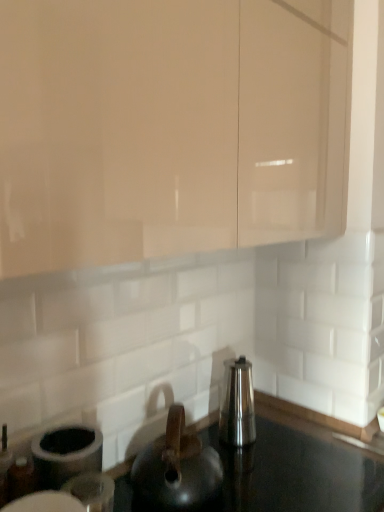
Identify the location of black glossy countertop at center. Image resolution: width=384 pixels, height=512 pixels. (296, 469).

What do you see at coordinates (296, 469) in the screenshot? I see `black glossy countertop at center` at bounding box center [296, 469].

This screenshot has width=384, height=512. I want to click on matte beige cabinet at upper center, so click(x=170, y=127).

Image resolution: width=384 pixels, height=512 pixels. What do you see at coordinates (237, 404) in the screenshot?
I see `satin silver kettle at center` at bounding box center [237, 404].

Find the location of a particular element. black glossy countertop at center is located at coordinates (296, 469).

Is matte beige cabinet at upper center facing towards satin silver kettle at center?

No, matte beige cabinet at upper center is not facing towards satin silver kettle at center.

Is matte beige cabinet at upper center taller or shorter than satin silver kettle at center?

Considering their sizes, matte beige cabinet at upper center has more height than satin silver kettle at center.

Is matte beige cabinet at upper center to the left or to the right of satin silver kettle at center in the image?

matte beige cabinet at upper center is positioned on satin silver kettle at center's left side.

Are matte black kettle at center and satin silver kettle at center making contact?

Yes, matte black kettle at center is right next to satin silver kettle at center and making contact.

Considering the sizes of objects matte black kettle at center and satin silver kettle at center in the image provided, who is shorter, matte black kettle at center or satin silver kettle at center?

Standing shorter between the two is matte black kettle at center.

Is matte black kettle at center at the right side of satin silver kettle at center?

In fact, matte black kettle at center is to the left of satin silver kettle at center.

Does matte black kettle at center have a larger size compared to satin silver kettle at center?

Yes, matte black kettle at center is bigger than satin silver kettle at center.

Identify the location of appliance located on the left of black glossy countertop at center. The height and width of the screenshot is (512, 384). (237, 404).

From a real-world perspective, is satin silver kettle at center positioned above or below black glossy countertop at center?

satin silver kettle at center is above black glossy countertop at center.

Is satin silver kettle at center wider or thinner than black glossy countertop at center?

In the image, satin silver kettle at center appears to be more narrow than black glossy countertop at center.

Is satin silver kettle at center not within black glossy countertop at center?

Indeed, satin silver kettle at center is completely outside black glossy countertop at center.

Is matte black kettle at center taller than matte beige cabinet at upper center?

Incorrect, the height of matte black kettle at center is not larger of that of matte beige cabinet at upper center.

Does matte black kettle at center come behind matte beige cabinet at upper center?

Yes.

From a real-world perspective, is black glossy countertop at center below matte beige cabinet at upper center?

Correct, in the physical world, black glossy countertop at center is lower than matte beige cabinet at upper center.

Which of these two, black glossy countertop at center or matte beige cabinet at upper center, is bigger?

matte beige cabinet at upper center.

Which object is positioned more to the right, black glossy countertop at center or matte beige cabinet at upper center?

From the viewer's perspective, black glossy countertop at center appears more on the right side.

Does satin silver kettle at center come in front of matte beige cabinet at upper center?

No, satin silver kettle at center is behind matte beige cabinet at upper center.

Looking at this image, from a real-world perspective, is satin silver kettle at center above or below matte beige cabinet at upper center?

satin silver kettle at center is below matte beige cabinet at upper center.

The height and width of the screenshot is (512, 384). Identify the location of cabinetry that appears above the satin silver kettle at center (from the image's perspective). (170, 127).

Are satin silver kettle at center and matte beige cabinet at upper center far apart?

satin silver kettle at center is near matte beige cabinet at upper center, not far away.

Between matte beige cabinet at upper center and matte black kettle at center, which one appears on the right side from the viewer's perspective?

Positioned to the right is matte beige cabinet at upper center.

Is matte beige cabinet at upper center positioned with its back to matte black kettle at center?

No, matte beige cabinet at upper center is not facing the opposite direction of matte black kettle at center.

Looking at this image, is matte beige cabinet at upper center thinner than matte black kettle at center?

No, matte beige cabinet at upper center is not thinner than matte black kettle at center.

Image resolution: width=384 pixels, height=512 pixels. What are the coordinates of `sink located on the left of matte beige cabinet at upper center` in the screenshot? It's located at (177, 470).

Locate an element on the screen. cabinetry on the left of satin silver kettle at center is located at coordinates (170, 127).

In order to click on appliance that is above the matte black kettle at center (from the image's perspective) in this screenshot , I will do `click(237, 404)`.

Looking at the image, which one is located closer to matte beige cabinet at upper center, black glossy countertop at center or matte black kettle at center?

matte black kettle at center is positioned closer to the anchor matte beige cabinet at upper center.

When comparing their distances from matte beige cabinet at upper center, does satin silver kettle at center or matte black kettle at center seem further?

Based on the image, satin silver kettle at center appears to be further to matte beige cabinet at upper center.

When comparing their distances from matte beige cabinet at upper center, does black glossy countertop at center or satin silver kettle at center seem closer?

satin silver kettle at center is positioned closer to the anchor matte beige cabinet at upper center.

From the picture: When comparing their distances from satin silver kettle at center, does matte beige cabinet at upper center or black glossy countertop at center seem further?

matte beige cabinet at upper center lies further to satin silver kettle at center than the other object.

Which object lies further to the anchor point matte beige cabinet at upper center, matte black kettle at center or black glossy countertop at center?

Based on the image, black glossy countertop at center appears to be further to matte beige cabinet at upper center.

From the picture: When comparing their distances from satin silver kettle at center, does matte beige cabinet at upper center or matte black kettle at center seem closer?

The object closer to satin silver kettle at center is matte black kettle at center.

Considering their positions, is matte beige cabinet at upper center positioned closer to matte black kettle at center than satin silver kettle at center?

satin silver kettle at center.

When comparing their distances from satin silver kettle at center, does matte black kettle at center or black glossy countertop at center seem further?

black glossy countertop at center is further to satin silver kettle at center.

Locate an element on the screen. Image resolution: width=384 pixels, height=512 pixels. appliance between matte beige cabinet at upper center and black glossy countertop at center vertically is located at coordinates (237, 404).

Where is `appliance between matte beige cabinet at upper center and matte black kettle at center in the vertical direction`? The width and height of the screenshot is (384, 512). appliance between matte beige cabinet at upper center and matte black kettle at center in the vertical direction is located at coordinates (237, 404).

Where is `sink between black glossy countertop at center and satin silver kettle at center along the z-axis`? sink between black glossy countertop at center and satin silver kettle at center along the z-axis is located at coordinates (x=177, y=470).

Where is `sink between matte beige cabinet at upper center and black glossy countertop at center in the up-down direction`? Image resolution: width=384 pixels, height=512 pixels. sink between matte beige cabinet at upper center and black glossy countertop at center in the up-down direction is located at coordinates (177, 470).